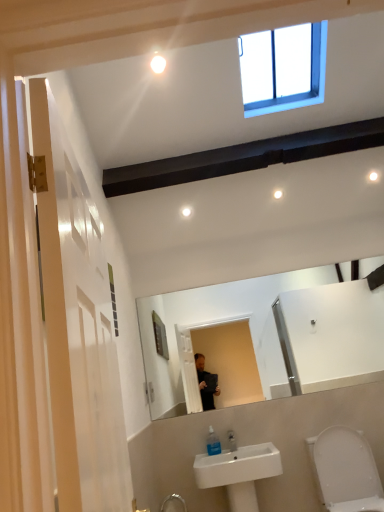
Question: Is clear plastic soap dispenser at lower center completely or partially outside of white glossy light bulb at upper center?

Choices:
 (A) yes
 (B) no

Answer: (A)

Question: From the image's perspective, is clear plastic soap dispenser at lower center beneath white glossy light bulb at upper center?

Choices:
 (A) no
 (B) yes

Answer: (B)

Question: Are clear plastic soap dispenser at lower center and white glossy light bulb at upper center located far from each other?

Choices:
 (A) no
 (B) yes

Answer: (B)

Question: Does clear plastic soap dispenser at lower center have a smaller size compared to white glossy light bulb at upper center?

Choices:
 (A) no
 (B) yes

Answer: (A)

Question: Considering the relative sizes of clear plastic soap dispenser at lower center and white glossy light bulb at upper center in the image provided, is clear plastic soap dispenser at lower center wider than white glossy light bulb at upper center?

Choices:
 (A) no
 (B) yes

Answer: (A)

Question: Is white glossy toilet at lower right taller or shorter than white glossy light bulb at upper center?

Choices:
 (A) tall
 (B) short

Answer: (A)

Question: In terms of width, does white glossy toilet at lower right look wider or thinner when compared to white glossy light bulb at upper center?

Choices:
 (A) thin
 (B) wide

Answer: (B)

Question: From a real-world perspective, relative to white glossy light bulb at upper center, is white glossy toilet at lower right vertically above or below?

Choices:
 (A) above
 (B) below

Answer: (B)

Question: Is point (380, 493) positioned closer to the camera than point (160, 57)?

Choices:
 (A) closer
 (B) farther

Answer: (B)

Question: Considering the relative positions of white ceramic sink at lower center and white glossy toilet at lower right in the image provided, is white ceramic sink at lower center to the left or to the right of white glossy toilet at lower right?

Choices:
 (A) right
 (B) left

Answer: (B)

Question: Considering their positions, is white ceramic sink at lower center located in front of or behind white glossy toilet at lower right?

Choices:
 (A) front
 (B) behind

Answer: (B)

Question: Considering the positions of white ceramic sink at lower center and white glossy toilet at lower right in the image, is white ceramic sink at lower center wider or thinner than white glossy toilet at lower right?

Choices:
 (A) wide
 (B) thin

Answer: (B)

Question: From the image's perspective, is white ceramic sink at lower center positioned above or below white glossy toilet at lower right?

Choices:
 (A) above
 (B) below

Answer: (B)

Question: From a real-world perspective, is white glossy light bulb at upper center positioned above or below white glossy toilet at lower right?

Choices:
 (A) below
 (B) above

Answer: (B)

Question: From the image's perspective, relative to white glossy toilet at lower right, is white glossy light bulb at upper center above or below?

Choices:
 (A) above
 (B) below

Answer: (A)